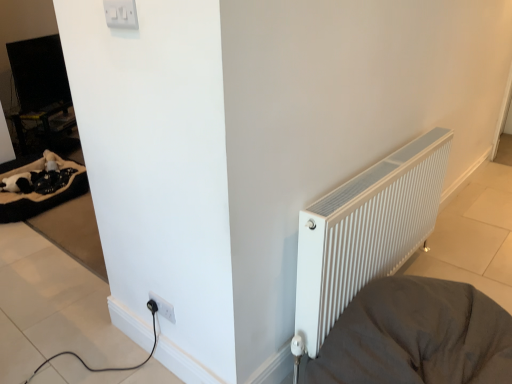
You are a GUI agent. You are given a task and a screenshot of the screen. Output one action in this format:
    pyautogui.click(x=<x>, y=<y>)
    Task: Click on the white ribbed radiator at right
    The width and height of the screenshot is (512, 384).
    Given the screenshot: What is the action you would take?
    pyautogui.click(x=366, y=231)

I want to click on wooden table at left, so click(38, 119).

Measure the distance between point (170, 312) and camera.

Point (170, 312) and camera are 5.32 feet apart from each other.

Where is `soft beige fabric at left`? This screenshot has width=512, height=384. soft beige fabric at left is located at coordinates (42, 188).

Is white plastic electric outlet at lower left, which is counted as the first electric outlet, starting from the bottom, positioned with its back to white ribbed radiator at right?

Yes, white ribbed radiator at right is at the back of white plastic electric outlet at lower left, which is counted as the first electric outlet, starting from the bottom.

What's the angular difference between white plastic electric outlet at lower left, which is the first electric outlet from back to front, and white ribbed radiator at right's facing directions?

The facing directions of white plastic electric outlet at lower left, which is the first electric outlet from back to front, and white ribbed radiator at right are 90.6 degrees apart.

Is the position of white plastic electric outlet at lower left, the 2th electric outlet positioned from the front, less distant than that of white ribbed radiator at right?

No, white plastic electric outlet at lower left, the 2th electric outlet positioned from the front, is further to the viewer.

Can we say white plastic electric outlet at lower left, which is counted as the first electric outlet, starting from the bottom, lies outside white ribbed radiator at right?

white plastic electric outlet at lower left, which is counted as the first electric outlet, starting from the bottom, is positioned outside white ribbed radiator at right.

Is white ribbed radiator at right surrounding white ribbed radiator at right?

No, white ribbed radiator at right is located outside of white ribbed radiator at right.

Relative to white ribbed radiator at right, is white ribbed radiator at right in front or behind?

white ribbed radiator at right is behind white ribbed radiator at right.

Is white ribbed radiator at right shorter than white ribbed radiator at right?

Incorrect, the height of white ribbed radiator at right does not fall short of that of white ribbed radiator at right.

Looking at this image, does white ribbed radiator at right come behind wooden table at left?

No, white ribbed radiator at right is closer to the viewer.

Considering the sizes of white ribbed radiator at right and wooden table at left in the image, is white ribbed radiator at right taller or shorter than wooden table at left?

Clearly, white ribbed radiator at right is shorter compared to wooden table at left.

From the image's perspective, would you say white ribbed radiator at right is positioned over wooden table at left?

No, from the image's perspective, white ribbed radiator at right is not over wooden table at left.

Which is closer to the camera, (411,336) or (51,109)?

Point (411,336) is closer to the camera than point (51,109).

Is white ribbed radiator at right placed right next to white plastic switch at upper center, marked as the first electric outlet in a top-to-bottom arrangement?

They are not placed beside each other.

Locate an element on the screen. This screenshot has height=384, width=512. the 1st electric outlet behind the white ribbed radiator at right is located at coordinates (121, 14).

Does point (383, 280) come closer to viewer compared to point (127, 9)?

No, it is behind (127, 9).

Is white ribbed radiator at right closer to camera compared to white plastic switch at upper center, placed as the 2th electric outlet when sorted from back to front?

Yes, it is in front of white plastic switch at upper center, placed as the 2th electric outlet when sorted from back to front.

Which of these two, wooden table at left or white ribbed radiator at right, stands taller?

wooden table at left is taller.

Which object is thinner, wooden table at left or white ribbed radiator at right?

wooden table at left is thinner.

Considering the relative positions of wooden table at left and white ribbed radiator at right in the image provided, is wooden table at left to the left of white ribbed radiator at right from the viewer's perspective?

Correct, you'll find wooden table at left to the left of white ribbed radiator at right.

Could you tell me if wooden table at left is turned towards white ribbed radiator at right?

No, wooden table at left is not turned towards white ribbed radiator at right.

Which is less distant, (155, 295) or (8, 218)?

Point (155, 295)

Considering the positions of objects white plastic electric outlet at lower left, the 2th electric outlet positioned from the front, and soft beige fabric at left in the image provided, who is more to the right, white plastic electric outlet at lower left, the 2th electric outlet positioned from the front, or soft beige fabric at left?

white plastic electric outlet at lower left, the 2th electric outlet positioned from the front, is more to the right.

Is white plastic electric outlet at lower left, which is the 2th electric outlet from top to bottom, next to soft beige fabric at left?

No, white plastic electric outlet at lower left, which is the 2th electric outlet from top to bottom, is not touching soft beige fabric at left.

Looking at this image, would you say soft beige fabric at left is part of white plastic electric outlet at lower left, the 2th electric outlet positioned from the front,'s contents?

No, white plastic electric outlet at lower left, the 2th electric outlet positioned from the front, does not contain soft beige fabric at left.

Considering the sizes of objects wooden table at left and soft beige fabric at left in the image provided, who is taller, wooden table at left or soft beige fabric at left?

Standing taller between the two is wooden table at left.

Does point (54, 111) come in front of point (23, 166)?

No, it is not.

Which object is further away from the camera taking this photo, wooden table at left or soft beige fabric at left?

wooden table at left is further away from the camera.

From a real-world perspective, between wooden table at left and soft beige fabric at left, who is vertically lower?

soft beige fabric at left is physically lower.

Where is `radiator on the right of the white plastic electric outlet at lower left, the 2th electric outlet positioned from the front`? radiator on the right of the white plastic electric outlet at lower left, the 2th electric outlet positioned from the front is located at coordinates (366, 231).

The image size is (512, 384). I want to click on furniture that appears below the white ribbed radiator at right (from the image's perspective), so click(416, 336).

Looking at the image, which one is located closer to white ribbed radiator at right, white plastic electric outlet at lower left, the 2th electric outlet positioned from the front, or white ribbed radiator at right?

white ribbed radiator at right lies closer to white ribbed radiator at right than the other object.

Looking at this image, looking at the image, which one is located further to soft beige fabric at left, wooden table at left or white ribbed radiator at right?

Among the two, white ribbed radiator at right is located further to soft beige fabric at left.

From the image, which object appears to be nearer to white ribbed radiator at right, white plastic electric outlet at lower left, the 2th electric outlet positioned from the front, or wooden table at left?

white plastic electric outlet at lower left, the 2th electric outlet positioned from the front.

Which object lies nearer to the anchor point white ribbed radiator at right, wooden table at left or white plastic switch at upper center, placed as the second electric outlet when sorted from bottom to top?

Among the two, white plastic switch at upper center, placed as the second electric outlet when sorted from bottom to top, is located nearer to white ribbed radiator at right.

When comparing their distances from white ribbed radiator at right, does white plastic switch at upper center, placed as the 2th electric outlet when sorted from back to front, or soft beige fabric at left seem closer?

white plastic switch at upper center, placed as the 2th electric outlet when sorted from back to front, is positioned closer to the anchor white ribbed radiator at right.

Which object lies nearer to the anchor point white plastic switch at upper center, which is counted as the 1th electric outlet, starting from the front, white ribbed radiator at right or soft beige fabric at left?

Based on the image, white ribbed radiator at right appears to be nearer to white plastic switch at upper center, which is counted as the 1th electric outlet, starting from the front.

Which object lies further to the anchor point wooden table at left, white ribbed radiator at right or soft beige fabric at left?

Based on the image, white ribbed radiator at right appears to be further to wooden table at left.

Estimate the real-world distances between objects in this image. Which object is closer to white ribbed radiator at right, wooden table at left or white plastic electric outlet at lower left, which is counted as the first electric outlet, starting from the bottom?

white plastic electric outlet at lower left, which is counted as the first electric outlet, starting from the bottom, is positioned closer to the anchor white ribbed radiator at right.

Where is `electric outlet between white plastic switch at upper center, placed as the 2th electric outlet when sorted from back to front, and soft beige fabric at left, along the z-axis`? electric outlet between white plastic switch at upper center, placed as the 2th electric outlet when sorted from back to front, and soft beige fabric at left, along the z-axis is located at coordinates (163, 307).

You are a GUI agent. You are given a task and a screenshot of the screen. Output one action in this format:
    pyautogui.click(x=<x>, y=<y>)
    Task: Click on the bedding between wooden table at left and white ribbed radiator at right in the horizontal direction
    
    Given the screenshot: What is the action you would take?
    tap(42, 188)

Locate an element on the screen. The height and width of the screenshot is (384, 512). radiator situated between white plastic electric outlet at lower left, the 2th electric outlet positioned from the front, and white ribbed radiator at right from left to right is located at coordinates (366, 231).

Locate an element on the screen. The width and height of the screenshot is (512, 384). radiator between white plastic switch at upper center, placed as the second electric outlet when sorted from bottom to top, and white ribbed radiator at right vertically is located at coordinates (366, 231).